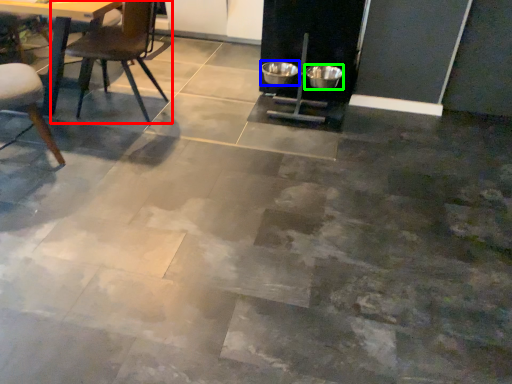
Question: Estimate the real-world distances between objects in this image. Which object is closer to chair (highlighted by a red box), bowl (highlighted by a blue box) or bowl (highlighted by a green box)?

Choices:
 (A) bowl
 (B) bowl

Answer: (A)